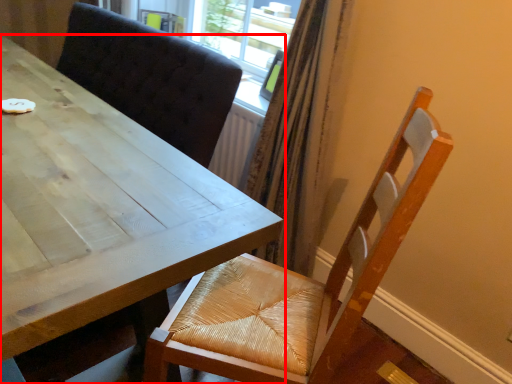
Question: From the image, what is the correct spatial relationship of table (annotated by the red box) in relation to chair?

Choices:
 (A) left
 (B) right

Answer: (A)